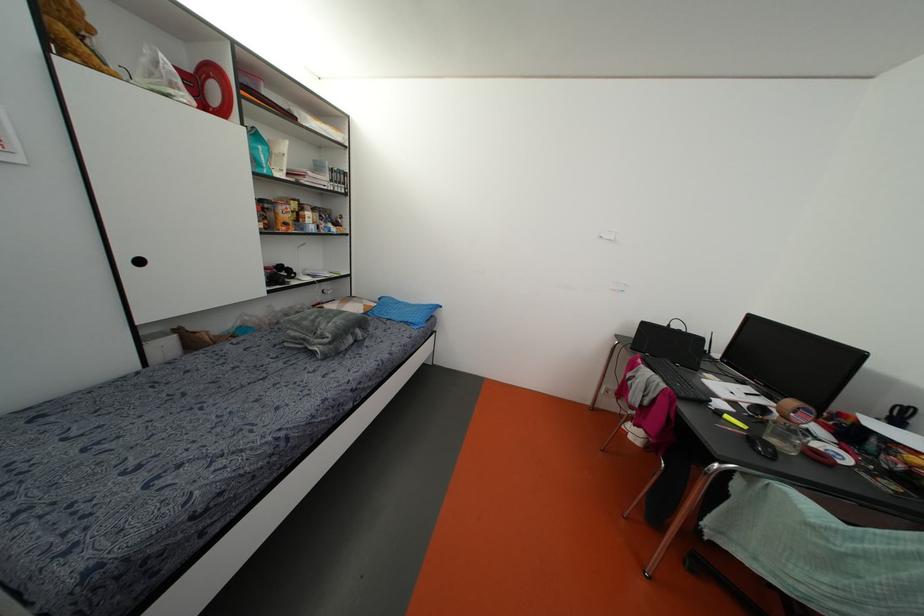
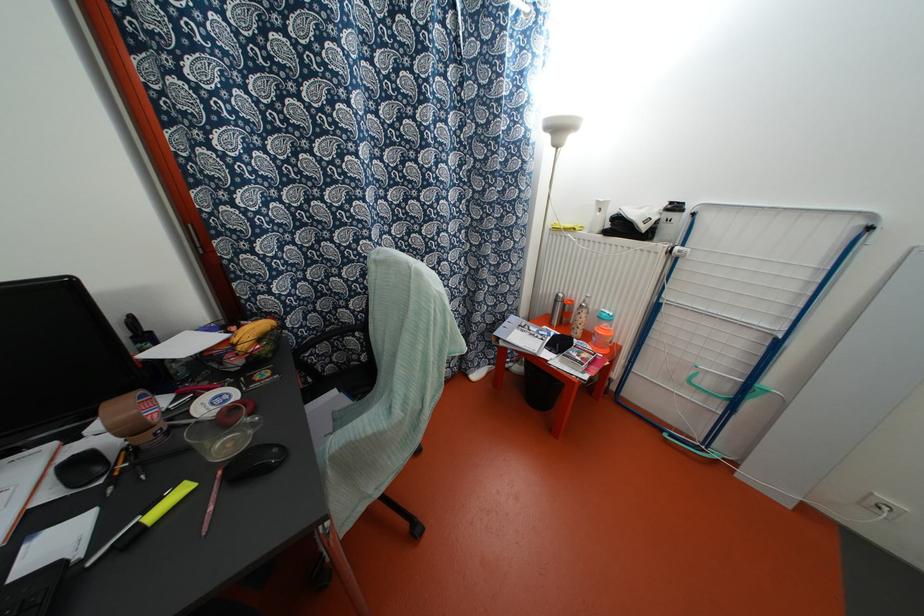
In the second image, find the point that corresponds to the point at 727,416 in the first image.

(152, 515)